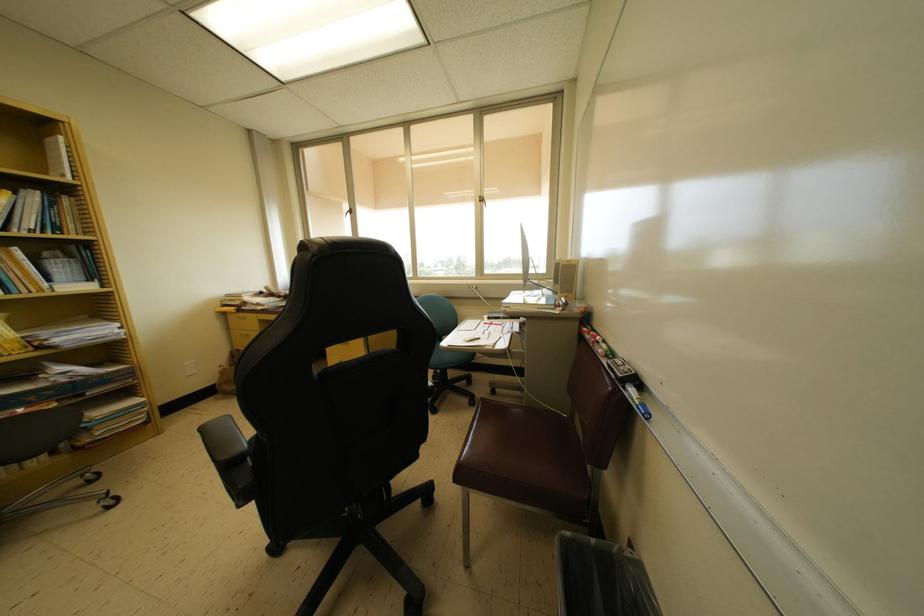
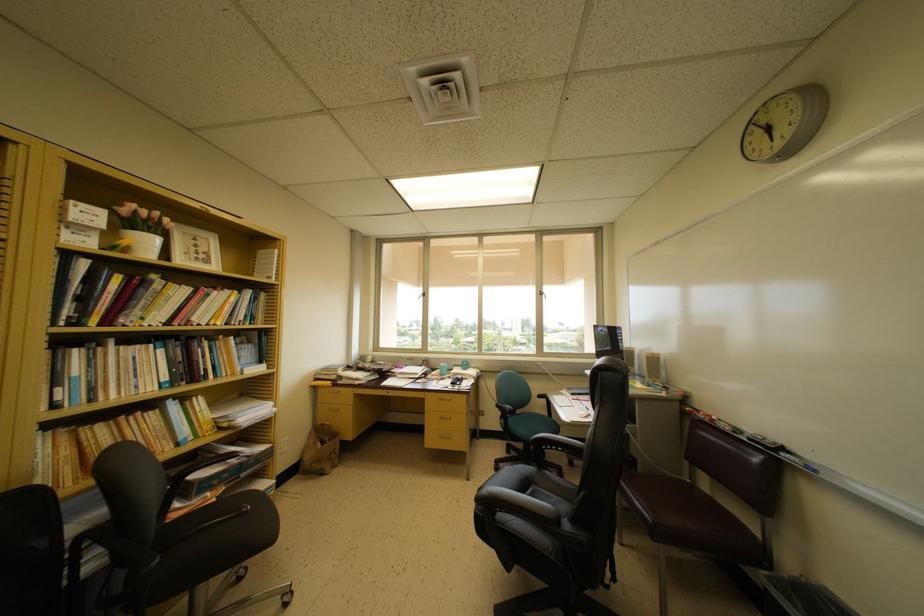
Locate, in the second image, the point that corresponds to point 639,385 in the first image.

(786, 454)